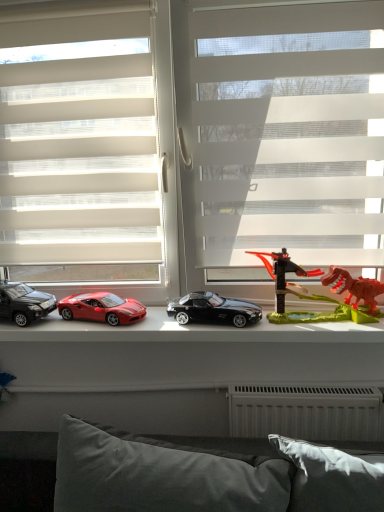
Question: Is black metallic car at center, the first car from the right, inside or outside of translucent plastic dinosaur at right?

Choices:
 (A) outside
 (B) inside

Answer: (A)

Question: Considering their positions, is black metallic car at center, the first car from the right, located in front of or behind translucent plastic dinosaur at right?

Choices:
 (A) front
 (B) behind

Answer: (B)

Question: Estimate the real-world distances between objects in this image. Which object is closer to the white sheer blinds at center, which is the second window from right to left?

Choices:
 (A) shiny red car at center, the second car viewed from the left
 (B) gray fabric pillow at lower center
 (C) white translucent blinds at center, the second window positioned from the left
 (D) shiny plastic toy cars at center
 (E) transparent plastic dinosaur at right

Answer: (C)

Question: Estimate the real-world distances between objects in this image. Which object is closer to the black metallic car at center, the first car from the right?

Choices:
 (A) white sheer blinds at center, which appears as the 1th window when viewed from the left
 (B) white translucent blinds at center, the first window positioned from the right
 (C) shiny black car at left, placed as the 1th car when sorted from left to right
 (D) gray fabric pillow at lower center
 (E) shiny plastic toy cars at center

Answer: (E)